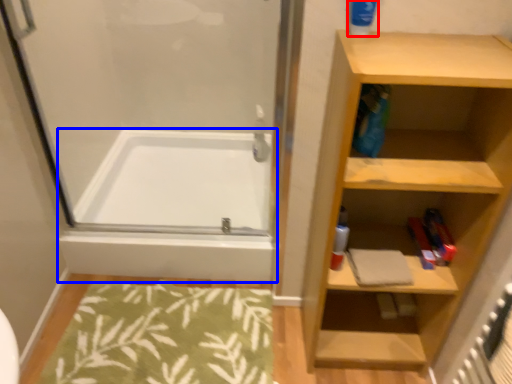
Question: Which object is further to the camera taking this photo, cleaning product (highlighted by a red box) or bathtub (highlighted by a blue box)?

Choices:
 (A) cleaning product
 (B) bathtub

Answer: (B)